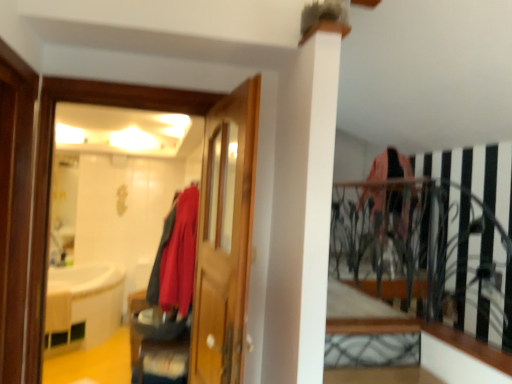
In order to face wooden door at center, should I rotate leftwards or rightwards?

Turn left by 5.138 degrees to look at wooden door at center.

What do you see at coordinates (176, 256) in the screenshot? I see `matte red coat at center` at bounding box center [176, 256].

The image size is (512, 384). Identify the location of brushed metal shoe at lower center. (156, 352).

The image size is (512, 384). Describe the element at coordinates (156, 352) in the screenshot. I see `brushed metal shoe at lower center` at that location.

Find the location of a particular element. The width and height of the screenshot is (512, 384). matte wooden mirror at left is located at coordinates (110, 213).

You are a GUI agent. You are given a task and a screenshot of the screen. Output one action in this format:
    pyautogui.click(x=<x>, y=<y>)
    Task: Click on the wooden door at center
    The image size is (512, 384).
    Given the screenshot: What is the action you would take?
    pyautogui.click(x=225, y=237)

Between point (145, 358) and point (428, 357), which one is positioned behind?

Point (145, 358)

Does brushed metal shoe at lower center appear on the right side of white wood ledge at lower right?

Incorrect, brushed metal shoe at lower center is not on the right side of white wood ledge at lower right.

Is brushed metal shoe at lower center oriented away from white wood ledge at lower right?

No, brushed metal shoe at lower center's orientation is not away from white wood ledge at lower right.

Which object is more forward, white wood ledge at lower right or matte wooden mirror at left?

→ matte wooden mirror at left is closer to the camera.

Visually, is white wood ledge at lower right positioned to the left or to the right of matte wooden mirror at left?

In the image, white wood ledge at lower right appears on the right side of matte wooden mirror at left.

Considering the relative sizes of white wood ledge at lower right and matte wooden mirror at left in the image provided, is white wood ledge at lower right wider than matte wooden mirror at left?

Indeed, white wood ledge at lower right has a greater width compared to matte wooden mirror at left.

Is white wood ledge at lower right turned away from matte wooden mirror at left?

That's not correct — white wood ledge at lower right is not looking away from matte wooden mirror at left.

Identify the location of mirror above the matte red coat at center (from the image's perspective). Image resolution: width=512 pixels, height=384 pixels. (110, 213).

Is matte red coat at center positioned with its back to matte wooden mirror at left?

matte red coat at center is not turned away from matte wooden mirror at left.

Does matte red coat at center touch matte wooden mirror at left?

No, matte red coat at center is not beside matte wooden mirror at left.

Where is `ledge that is above the brushed metal shoe at lower center (from the image's perspective)`? ledge that is above the brushed metal shoe at lower center (from the image's perspective) is located at coordinates (462, 357).

Which object is closer to the camera, white wood ledge at lower right or brushed metal shoe at lower center?

white wood ledge at lower right is in front.

In the scene shown: Between white wood ledge at lower right and brushed metal shoe at lower center, which one appears on the left side from the viewer's perspective?

brushed metal shoe at lower center is more to the left.

From a real-world perspective, is white wood ledge at lower right below brushed metal shoe at lower center?

Incorrect, from a real-world perspective, white wood ledge at lower right is higher than brushed metal shoe at lower center.

Is matte red coat at center facing away from brushed metal shoe at lower center?

That's not correct — matte red coat at center is not looking away from brushed metal shoe at lower center.

Between point (194, 220) and point (155, 358), which one is positioned in front?

The point (194, 220) is more forward.

Between matte red coat at center and brushed metal shoe at lower center, which one appears on the left side from the viewer's perspective?

From the viewer's perspective, brushed metal shoe at lower center appears more on the left side.

Considering the relative positions of matte red coat at center and white wood ledge at lower right in the image provided, is matte red coat at center behind white wood ledge at lower right?

That is True.

In terms of size, does matte red coat at center appear bigger or smaller than white wood ledge at lower right?

Considering their sizes, matte red coat at center takes up more space than white wood ledge at lower right.

Which of these two, matte red coat at center or white wood ledge at lower right, is thinner?

matte red coat at center is thinner.

Between matte red coat at center and white wood ledge at lower right, which one appears on the right side from the viewer's perspective?

white wood ledge at lower right.

From a real-world perspective, is white wood ledge at lower right physically below matte red coat at center?

Yes, from a real-world perspective, white wood ledge at lower right is beneath matte red coat at center.

In terms of height, does white wood ledge at lower right look taller or shorter compared to matte red coat at center?

white wood ledge at lower right is shorter than matte red coat at center.

Looking at this image, is white wood ledge at lower right facing away from matte red coat at center?

No, white wood ledge at lower right's orientation is not away from matte red coat at center.

Identify the location of ledge in front of the brushed metal shoe at lower center. Image resolution: width=512 pixels, height=384 pixels. (462, 357).

The width and height of the screenshot is (512, 384). What are the coordinates of `ledge beneath the matte wooden mirror at left (from a real-world perspective)` in the screenshot? It's located at (462, 357).

From the picture: Considering their positions, is wooden door at center positioned closer to brushed metal shoe at lower center than white wood ledge at lower right?

The object closer to brushed metal shoe at lower center is wooden door at center.

Consider the image. Based on their spatial positions, is brushed metal shoe at lower center or white wood ledge at lower right further from matte red coat at center?

The object further to matte red coat at center is white wood ledge at lower right.

Estimate the real-world distances between objects in this image. Which object is further from wooden door at center, white wood ledge at lower right or brushed metal shoe at lower center?

brushed metal shoe at lower center.

Which object lies nearer to the anchor point matte wooden mirror at left, white wood ledge at lower right or wooden door at center?

Among the two, wooden door at center is located nearer to matte wooden mirror at left.

Based on their spatial positions, is matte red coat at center or wooden door at center closer to white wood ledge at lower right?

wooden door at center is closer to white wood ledge at lower right.

Consider the image. Considering their positions, is wooden door at center positioned closer to matte wooden mirror at left than brushed metal shoe at lower center?

Among the two, brushed metal shoe at lower center is located nearer to matte wooden mirror at left.

From the image, which object appears to be farther from brushed metal shoe at lower center, white wood ledge at lower right or wooden door at center?

The object further to brushed metal shoe at lower center is white wood ledge at lower right.

Looking at the image, which one is located closer to brushed metal shoe at lower center, white wood ledge at lower right or matte red coat at center?

Based on the image, matte red coat at center appears to be nearer to brushed metal shoe at lower center.

Where is `mirror between matte red coat at center and white wood ledge at lower right in the horizontal direction`? The height and width of the screenshot is (384, 512). mirror between matte red coat at center and white wood ledge at lower right in the horizontal direction is located at coordinates [x=110, y=213].

I want to click on furniture between matte wooden mirror at left and matte red coat at center from front to back, so click(156, 352).

Where is `door between matte wooden mirror at left and white wood ledge at lower right from left to right`? door between matte wooden mirror at left and white wood ledge at lower right from left to right is located at coordinates (225, 237).

Locate an element on the screen. door situated between matte red coat at center and white wood ledge at lower right from left to right is located at coordinates (225, 237).